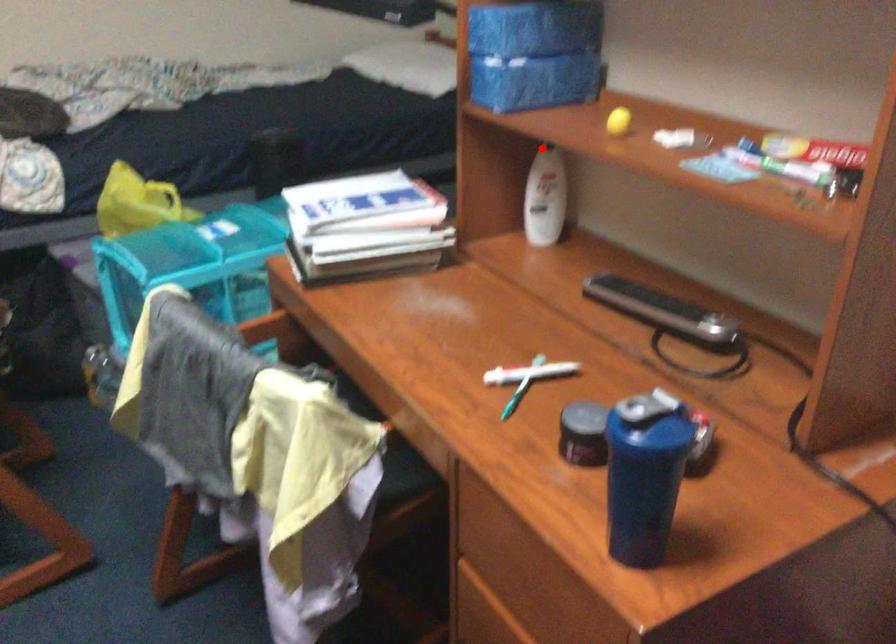
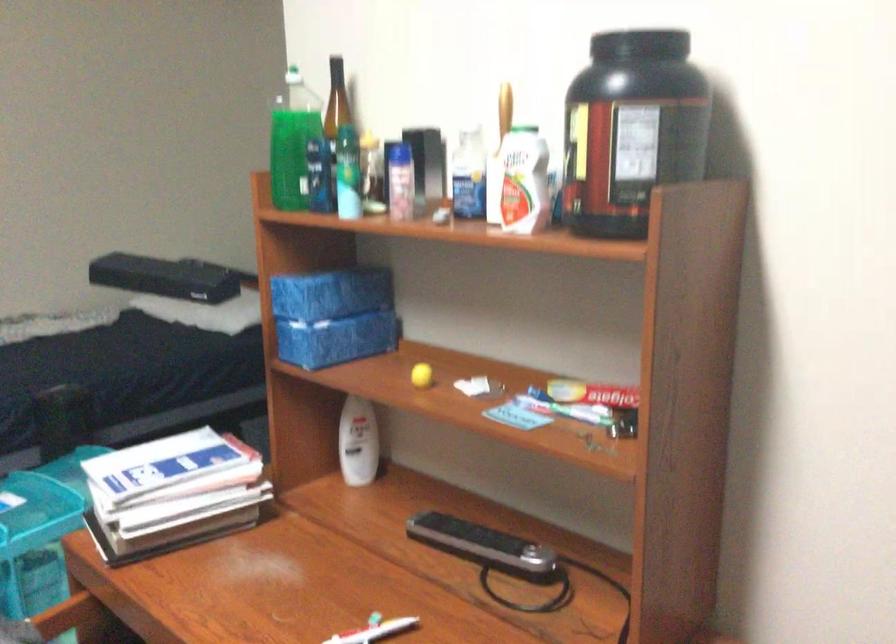
Question: I am providing you with two images of the same scene from different viewpoints. A red point is marked on the first image. At the location where the point appears in image 1, is it still visible in image 2?

Choices:
 (A) Yes
 (B) No

Answer: (B)